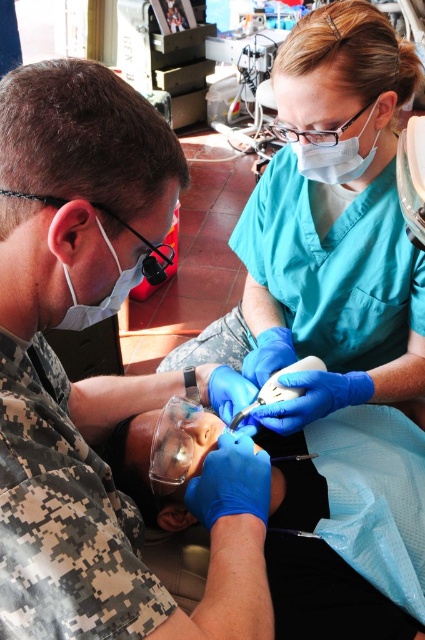
Who is positioned more to the right, blue rubber gloves at lower center or matte white mask at left?

matte white mask at left is more to the right.

Is blue rubber gloves at lower center to the left of matte white mask at left from the viewer's perspective?

Correct, you'll find blue rubber gloves at lower center to the left of matte white mask at left.

Between point (260, 625) and point (99, 227), which one is positioned behind?

The point (99, 227) is more distant.

You are a GUI agent. You are given a task and a screenshot of the screen. Output one action in this format:
    pyautogui.click(x=<x>, y=<y>)
    Task: Click on the blue rubber gloves at lower center
    The width and height of the screenshot is (425, 640).
    Given the screenshot: What is the action you would take?
    pyautogui.click(x=98, y=376)

Who is higher up, white fabric mask at center or matte white mask at left?

white fabric mask at center is above.

Is white fabric mask at center taller than matte white mask at left?

No, white fabric mask at center is not taller than matte white mask at left.

Image resolution: width=425 pixels, height=640 pixels. In order to click on white fabric mask at center in this screenshot , I will do click(329, 150).

Does teal fabric scrubs at center appear on the left side of white plastic dental drill at center?

In fact, teal fabric scrubs at center is to the right of white plastic dental drill at center.

Is teal fabric scrubs at center shorter than white plastic dental drill at center?

No.

Image resolution: width=425 pixels, height=640 pixels. What do you see at coordinates (329, 228) in the screenshot? I see `teal fabric scrubs at center` at bounding box center [329, 228].

Identify the location of teal fabric scrubs at center. (329, 228).